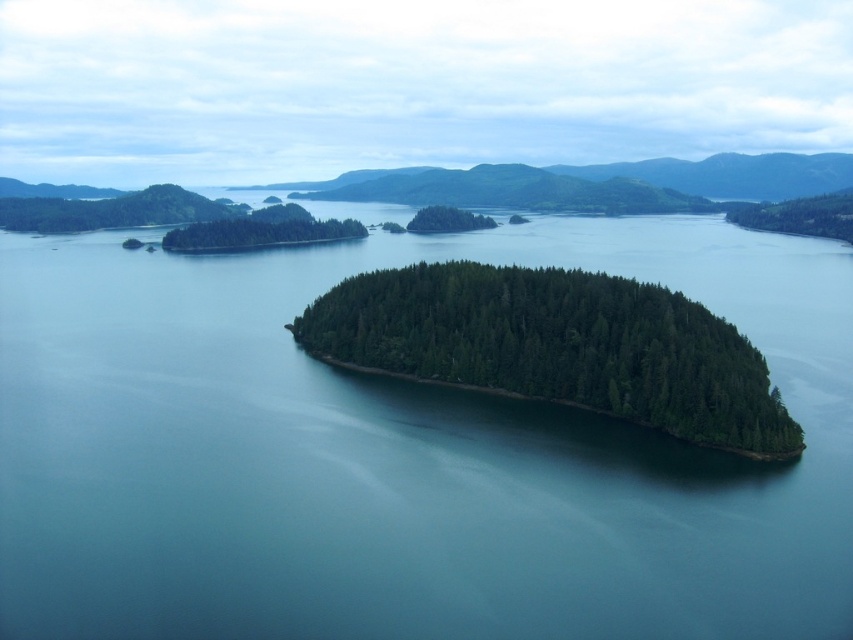
Question: Among these objects, which one is farthest from the camera?

Choices:
 (A) green matte tree at center
 (B) greenish-blue water at center
 (C) green matte island at center
 (D) green matte tree at upper left

Answer: (A)

Question: Which point appears closest to the camera in this image?

Choices:
 (A) (440, 332)
 (B) (160, 209)
 (C) (817, 202)
 (D) (463, 228)

Answer: (A)

Question: Is green matte forest at upper left closer to camera compared to green matte tree at center?

Choices:
 (A) no
 (B) yes

Answer: (A)

Question: Which is nearer to the green matte tree at center?

Choices:
 (A) green matte island at center
 (B) green matte forest at right
 (C) green matte tree at upper left
 (D) green matte forest at upper left

Answer: (C)

Question: Is green matte forest at right wider than green matte tree at center?

Choices:
 (A) yes
 (B) no

Answer: (A)

Question: Does green matte island at center appear on the right side of green matte tree at upper left?

Choices:
 (A) yes
 (B) no

Answer: (A)